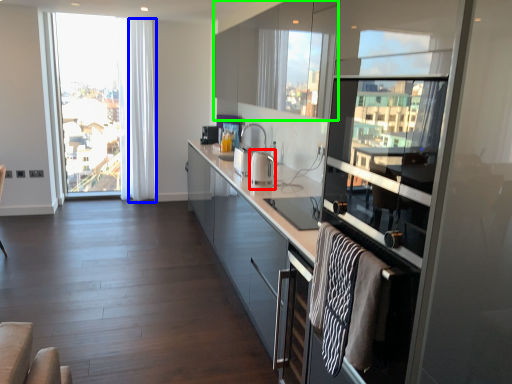
Question: Which object is the farthest from appliance (highlighted by a red box)? Choose among these: curtain (highlighted by a blue box) or cabinetry (highlighted by a green box).

Choices:
 (A) curtain
 (B) cabinetry

Answer: (A)